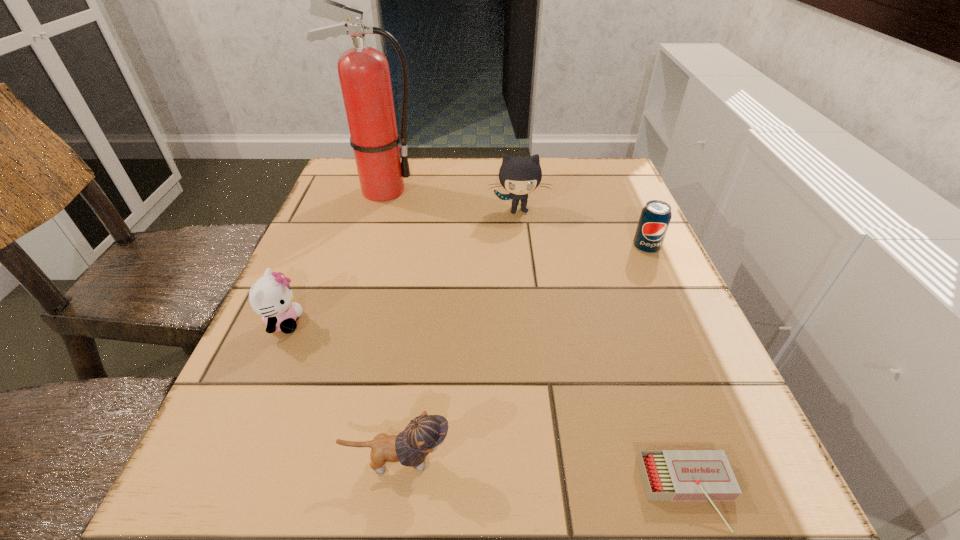
You are a GUI agent. You are given a task and a screenshot of the screen. Output one action in this format:
    pyautogui.click(x=<x>, y=<y>)
    Task: Click on the blank region between the second kitten from left to right and the soda can
    
    Given the screenshot: What is the action you would take?
    pyautogui.click(x=522, y=355)

The width and height of the screenshot is (960, 540). What are the coordinates of `vacant area between the nearest kitten and the fire extinguisher` in the screenshot? It's located at coord(390,326).

Choose which object is the nearest neighbor to the third farthest object. Please provide its 2D coordinates. Your answer should be formatted as a tuple, i.e. [(x, y)], where the tuple contains the x and y coordinates of a point satisfying the conditions above.

[(518, 175)]

In order to click on object that is the third closest to the second kitten from left to right in this screenshot , I will do `click(655, 217)`.

Select which kitten is the closest to the rightmost object. Please provide its 2D coordinates. Your answer should be formatted as a tuple, i.e. [(x, y)], where the tuple contains the x and y coordinates of a point satisfying the conditions above.

[(518, 175)]

What are the coordinates of `kitten that is the second closest to the third farthest object` in the screenshot? It's located at (424, 433).

Where is `vacant region that satisfies the following two spatial constraints: 1. on the back side of the rightmost object; 2. on the hose direction of the tallest object`? The height and width of the screenshot is (540, 960). vacant region that satisfies the following two spatial constraints: 1. on the back side of the rightmost object; 2. on the hose direction of the tallest object is located at coordinates (620, 191).

Where is `free location that satisfies the following two spatial constraints: 1. on the front-facing side of the tallest kitten; 2. on the right side of the fourth nearest object`? This screenshot has width=960, height=540. free location that satisfies the following two spatial constraints: 1. on the front-facing side of the tallest kitten; 2. on the right side of the fourth nearest object is located at coordinates (522, 248).

This screenshot has width=960, height=540. In order to click on vacant space that satisfies the following two spatial constraints: 1. on the hose direction of the rightmost object; 2. on the left side of the fire extinguisher in this screenshot , I will do pyautogui.click(x=364, y=248).

Identify the location of vacant point that satisfies the following two spatial constraints: 1. on the front-facing side of the farthest kitten; 2. on the front-facing side of the nearest kitten. This screenshot has height=540, width=960. (547, 462).